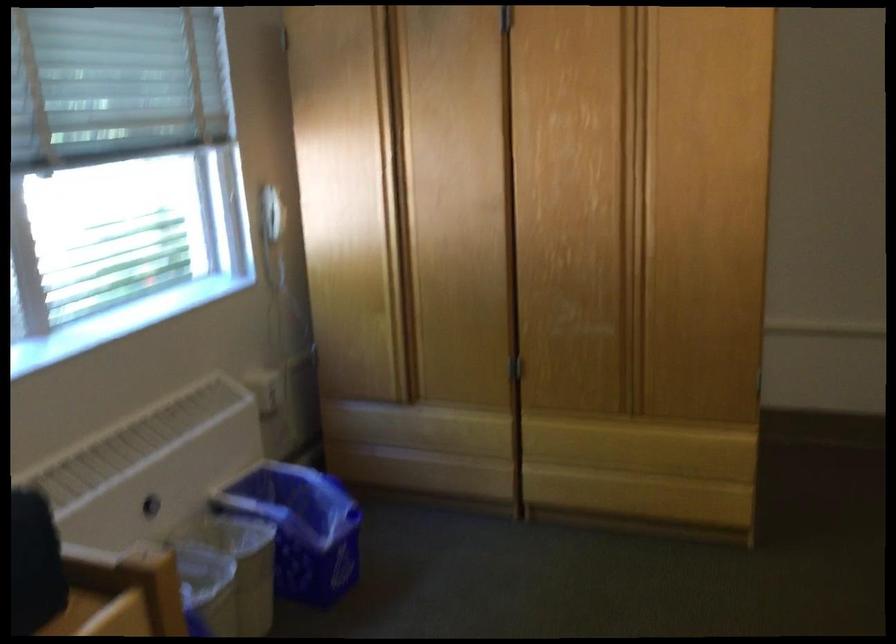
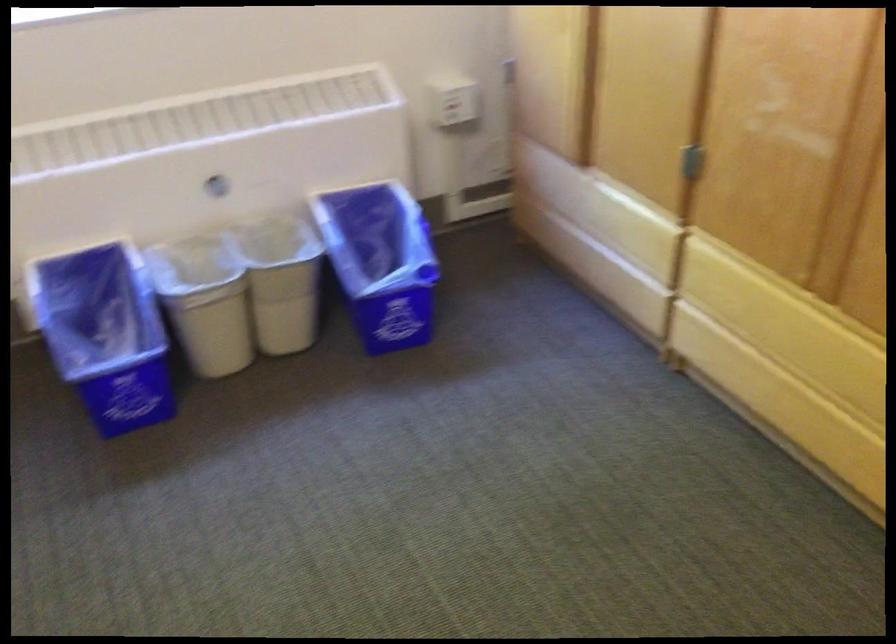
Find the pixel in the second image that matches pixel 277 536 in the first image.

(380, 261)